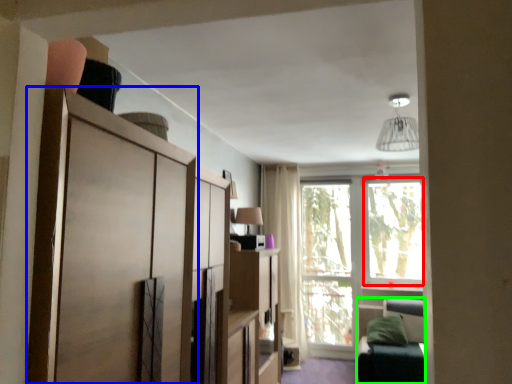
Question: Which object is the closest to the window screen (highlighted by a red box)? Choose among these: cabinetry (highlighted by a blue box) or bunk bed (highlighted by a green box).

Choices:
 (A) cabinetry
 (B) bunk bed

Answer: (B)